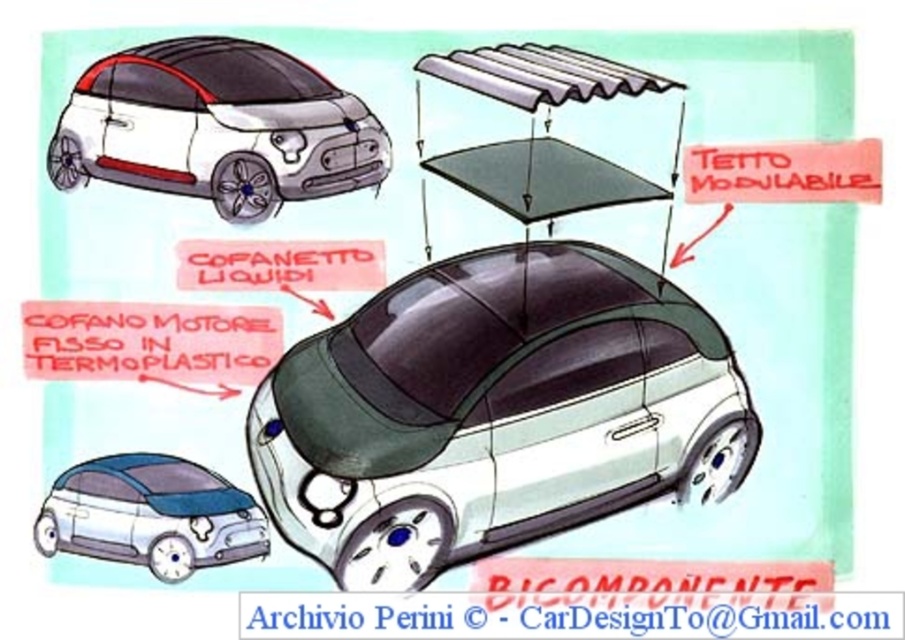
Is point (245, 65) closer to camera compared to point (169, 456)?

No, (245, 65) is further to viewer.

Between white matte car at upper left and matte blue car at lower left, which one has more height?

white matte car at upper left is taller.

Where is `white matte car at upper left`? The width and height of the screenshot is (905, 640). white matte car at upper left is located at coordinates (217, 128).

The image size is (905, 640). I want to click on white matte car at upper left, so click(217, 128).

Does green matte car at center have a smaller size compared to matte blue car at lower left?

No, green matte car at center is not smaller than matte blue car at lower left.

Find the location of a particular element. green matte car at center is located at coordinates (494, 412).

Locate an element on the screen. green matte car at center is located at coordinates (494, 412).

Between green matte car at center and white matte car at upper left, which one is positioned lower?

green matte car at center is lower down.

Is point (569, 266) positioned behind point (329, 112)?

That is True.

Locate an element on the screen. This screenshot has width=905, height=640. green matte car at center is located at coordinates 494,412.